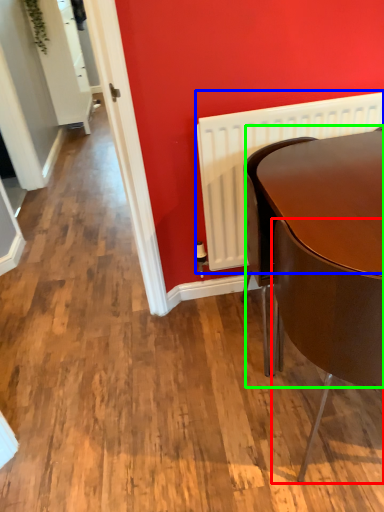
Question: Which is nearer to the chair (highlighted by a red box)? radiator (highlighted by a blue box) or round table (highlighted by a green box).

Choices:
 (A) radiator
 (B) round table

Answer: (B)